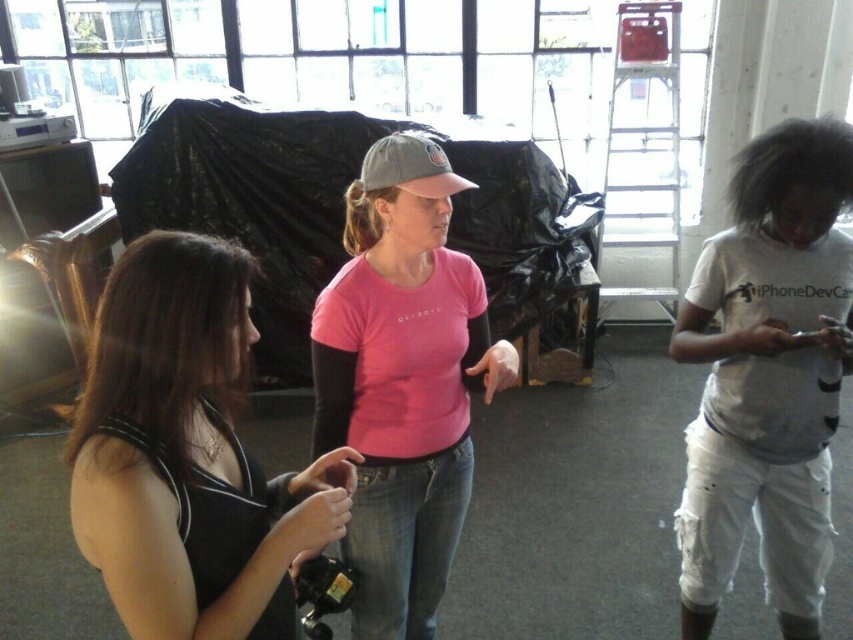
Is black matte tank top at center positioned in front of gray fabric baseball cap at center?

Yes, black matte tank top at center is closer to the viewer.

Does black matte tank top at center have a greater width compared to gray fabric baseball cap at center?

Yes, black matte tank top at center is wider than gray fabric baseball cap at center.

The width and height of the screenshot is (853, 640). Find the location of `black matte tank top at center`. black matte tank top at center is located at coordinates (x=189, y=454).

Identify the location of black matte tank top at center. The width and height of the screenshot is (853, 640). (189, 454).

Who is positioned more to the right, white cotton shirt at right or gray fabric baseball cap at center?

Positioned to the right is white cotton shirt at right.

Which is in front, point (717, 410) or point (397, 176)?

Point (397, 176) is more forward.

Identify the location of white cotton shirt at right. The height and width of the screenshot is (640, 853). (769, 376).

Is point (788, 355) behind point (463, 276)?

No, (788, 355) is closer to viewer.

The image size is (853, 640). Describe the element at coordinates (769, 376) in the screenshot. I see `white cotton shirt at right` at that location.

Image resolution: width=853 pixels, height=640 pixels. Identify the location of white cotton shirt at right. (769, 376).